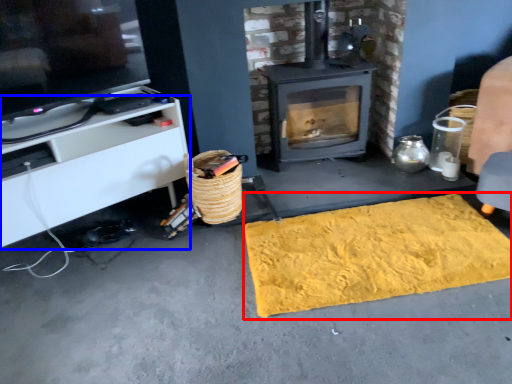
Question: Which object is closer to the camera taking this photo, mat (highlighted by a red box) or cabinetry (highlighted by a blue box)?

Choices:
 (A) mat
 (B) cabinetry

Answer: (B)